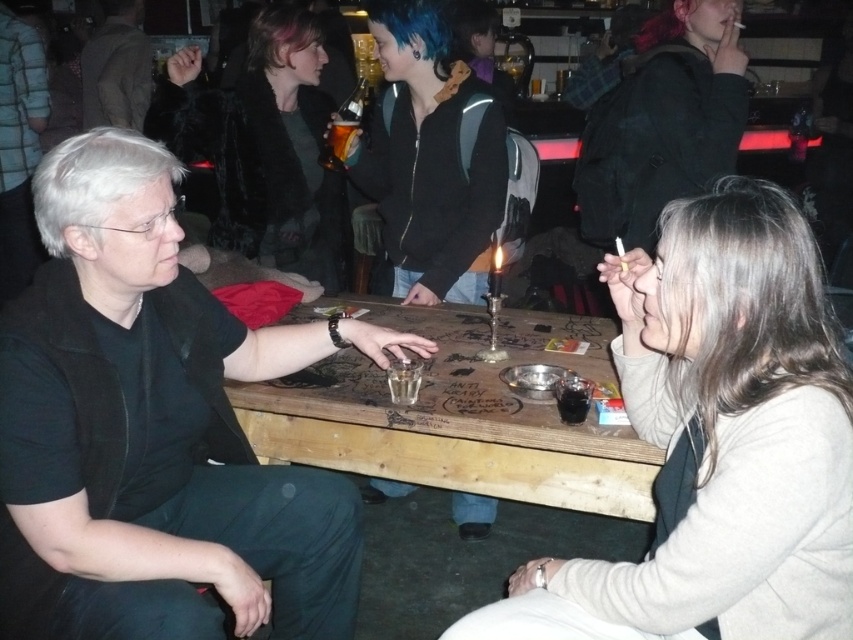
You are a bartender who needs to serve a customer. You see the white matte hair at left and the translucent amber liquid at center. Which one is bigger in size?

The white matte hair at left is larger in size compared to the translucent amber liquid at center.

You are a photographer trying to capture a candid shot of both the white matte hair at left and the blue matte hair at upper center in the same frame. Which person should you focus on first to ensure both are in focus?

You should focus on the white matte hair at left first because it is closer to the viewer than the blue matte hair at upper center. By focusing on the closer subject, both will be in focus as the depth of field will include the farther subject.